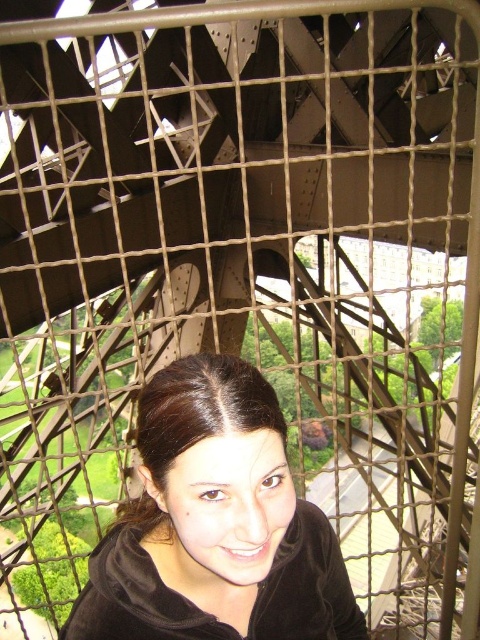
Is point (157, 465) farther from viewer compared to point (229, 397)?

That is False.

Between matte black hoodie at center and dark brown hair at center, which one appears on the left side from the viewer's perspective?

Positioned to the left is dark brown hair at center.

Does point (298, 611) lie behind point (237, 387)?

That is True.

The height and width of the screenshot is (640, 480). I want to click on matte black hoodie at center, so click(x=215, y=524).